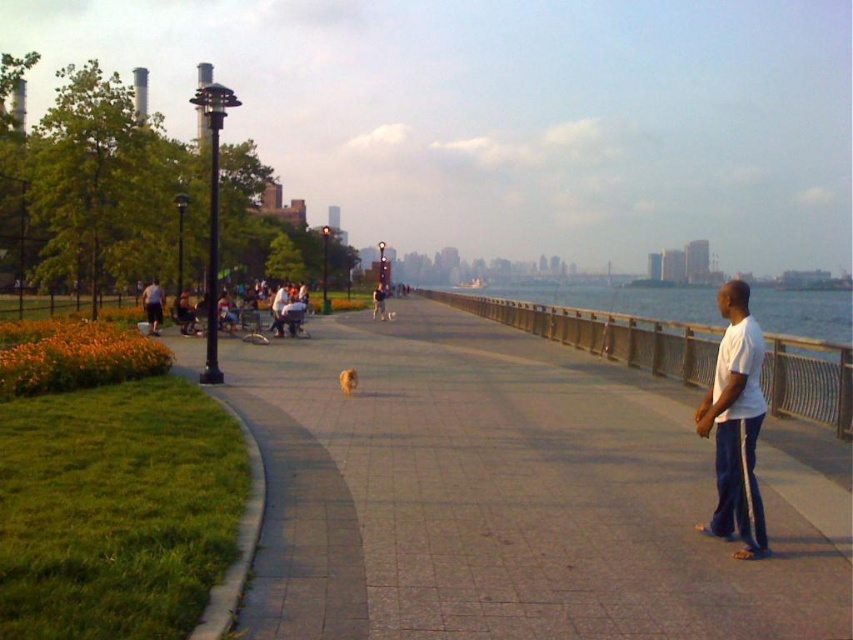
Question: Can you confirm if clear glass waterway at center is thinner than dark gray shirt at left?

Choices:
 (A) no
 (B) yes

Answer: (A)

Question: Which point is closer to the camera?

Choices:
 (A) (352, 387)
 (B) (161, 310)

Answer: (A)

Question: Which object appears closest to the camera in this image?

Choices:
 (A) golden fur dog at center
 (B) matte black stroller at left

Answer: (A)

Question: From the image, what is the correct spatial relationship of white smooth shirt at right in relation to dark gray shirt at left?

Choices:
 (A) left
 (B) right

Answer: (B)

Question: Estimate the real-world distances between objects in this image. Which object is farther from the golden fur dog at center?

Choices:
 (A) brown brick pavement at center
 (B) white cotton shirt at center
 (C) white smooth shirt at right
 (D) matte black stroller at left

Answer: (B)

Question: In this image, where is brown brick pavement at center located relative to golden fur dog at center?

Choices:
 (A) left
 (B) right

Answer: (B)